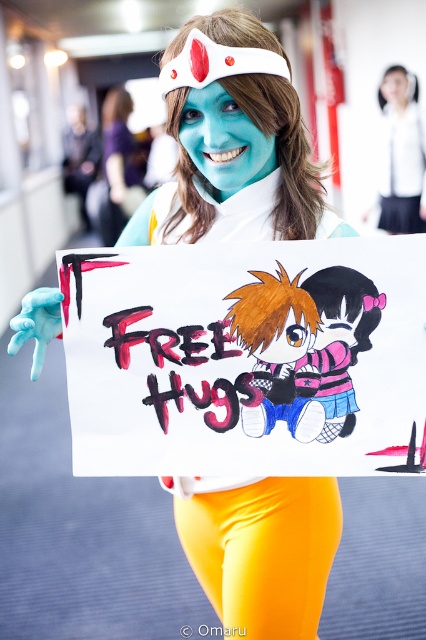
Question: Which object appears farthest from the camera in this image?

Choices:
 (A) white fabric shirt at upper center
 (B) matte blue face paint at center

Answer: (B)

Question: Which is farther from the white fabric shirt at upper center?

Choices:
 (A) matte white headband at upper center
 (B) blue matte face at center

Answer: (B)

Question: Is blue matte face at center wider than matte white headband at upper center?

Choices:
 (A) yes
 (B) no

Answer: (A)

Question: Which point is farther from the camera taking this photo?

Choices:
 (A) (400, 68)
 (B) (270, 140)

Answer: (A)

Question: Does pastel pink fabric plush at center lie in front of matte blue face paint at center?

Choices:
 (A) yes
 (B) no

Answer: (A)

Question: Does blue matte face at center lie in front of matte blue face paint at center?

Choices:
 (A) yes
 (B) no

Answer: (A)